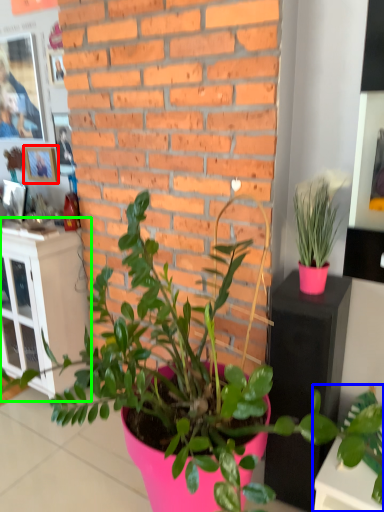
Question: Considering the real-world distances, which object is closest to picture frame (highlighted by a red box)? houseplant (highlighted by a blue box) or file cabinet (highlighted by a green box).

Choices:
 (A) houseplant
 (B) file cabinet

Answer: (B)